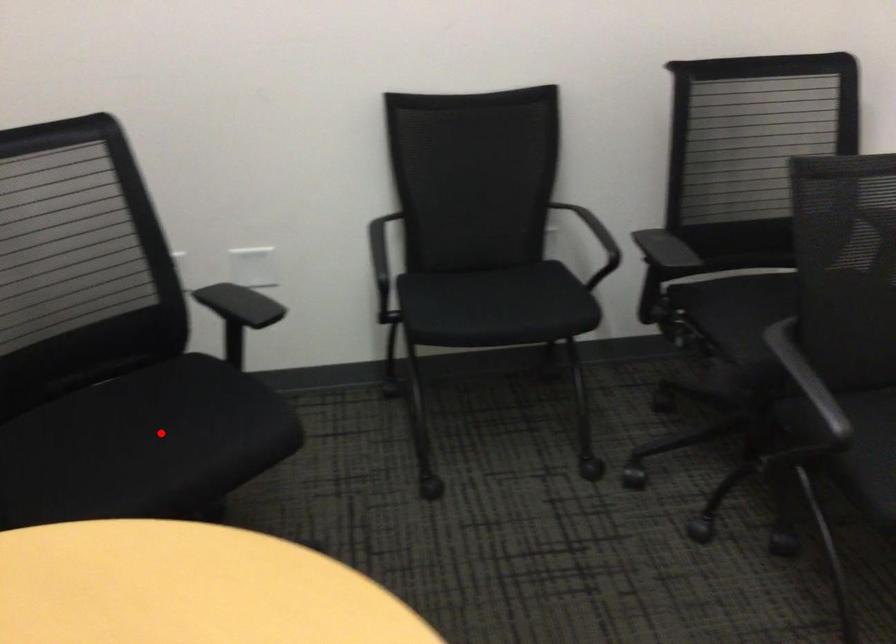
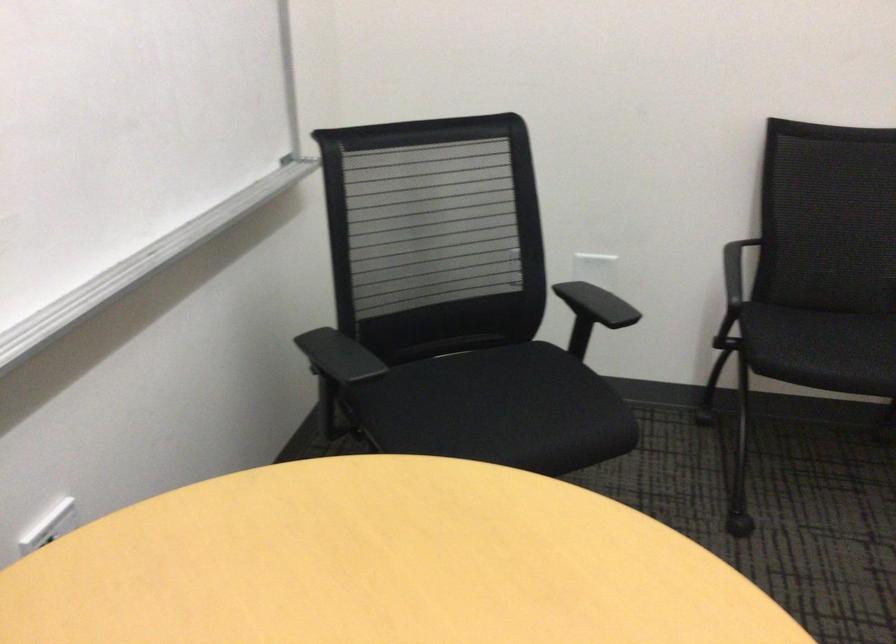
The point at the highlighted location is marked in the first image. Where is the corresponding point in the second image?

(497, 410)